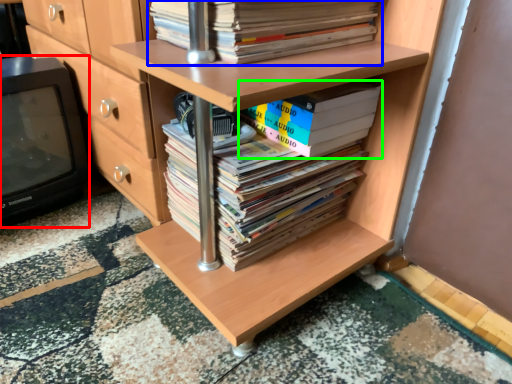
Question: Which is farther away from wide (highlighted by a red box)? book (highlighted by a blue box) or book (highlighted by a green box)?

Choices:
 (A) book
 (B) book

Answer: (B)